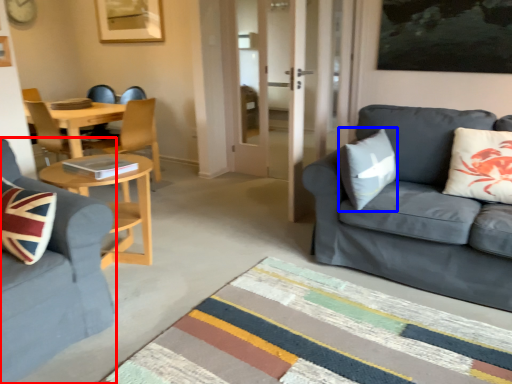
Question: Which of the following is the farthest to the observer, studio couch (highlighted by a red box) or pillow (highlighted by a blue box)?

Choices:
 (A) studio couch
 (B) pillow

Answer: (B)